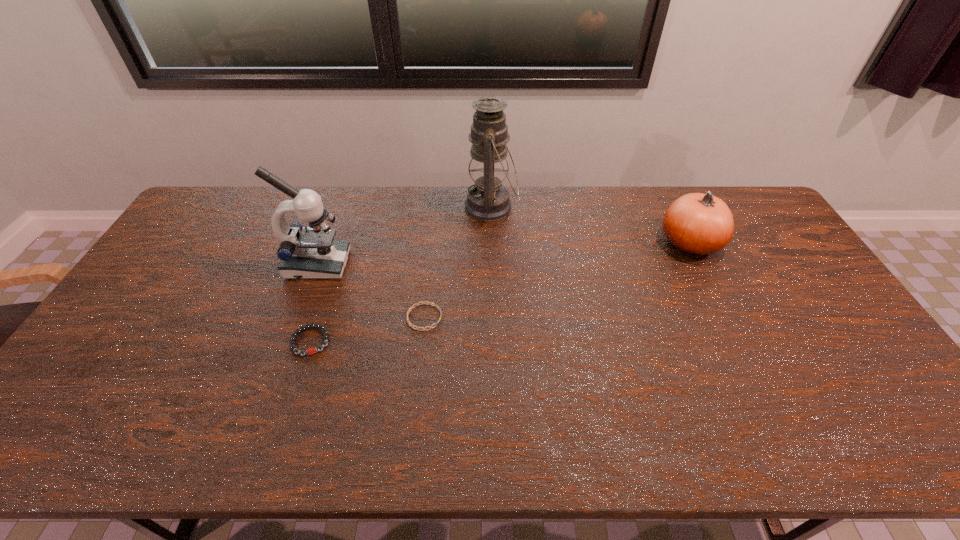
I want to click on oil lamp, so click(487, 200).

At what (x,y) coordinates should I click in order to perform the action: click on microscope. Please return your answer as a coordinate pair (x, y). Looking at the image, I should click on (312, 253).

Find the location of a particular element. The height and width of the screenshot is (540, 960). pumpkin is located at coordinates (697, 224).

Find the location of a particular element. the third tallest object is located at coordinates pos(697,224).

The image size is (960, 540). I want to click on the left bracelet, so click(310, 351).

This screenshot has height=540, width=960. Find the location of `the fourth tallest object`. the fourth tallest object is located at coordinates (310, 351).

I want to click on the shortest object, so click(416, 304).

This screenshot has height=540, width=960. In order to click on the right bracelet in this screenshot , I will do `click(416, 304)`.

Locate an element on the screen. The image size is (960, 540). vacant position located 0.240m on the front of the fourth object from left to right is located at coordinates (493, 281).

Locate an element on the screen. vacant space located 0.390m at the eyepiece of the microscope is located at coordinates (471, 265).